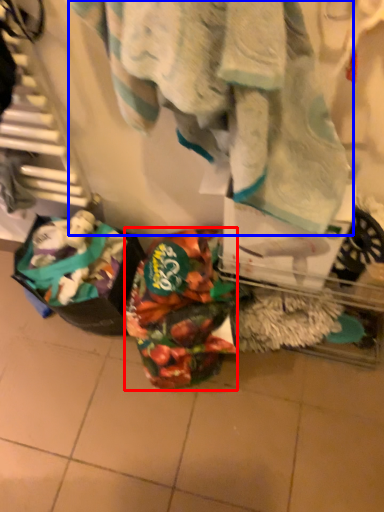
Question: Which point is further to the camera, waste (highlighted by a red box) or towel (highlighted by a blue box)?

Choices:
 (A) waste
 (B) towel

Answer: (A)